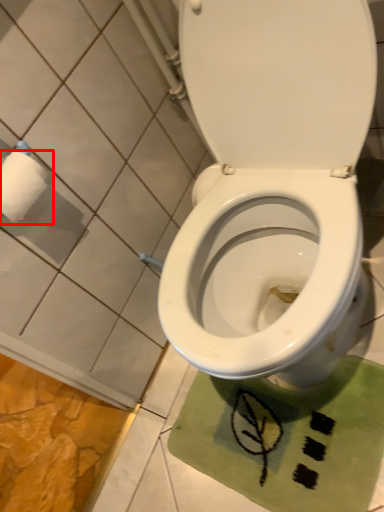
Question: From the image's perspective, where is toilet paper (annotated by the red box) located relative to bath mat?

Choices:
 (A) above
 (B) below

Answer: (A)